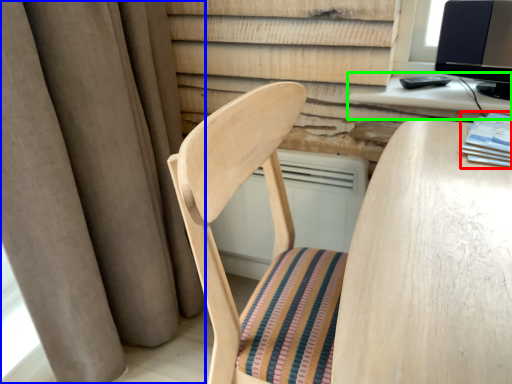
Question: Estimate the real-world distances between objects in this image. Which object is farther from book (highlighted by a red box), curtain (highlighted by a blue box) or computer desk (highlighted by a green box)?

Choices:
 (A) curtain
 (B) computer desk

Answer: (A)